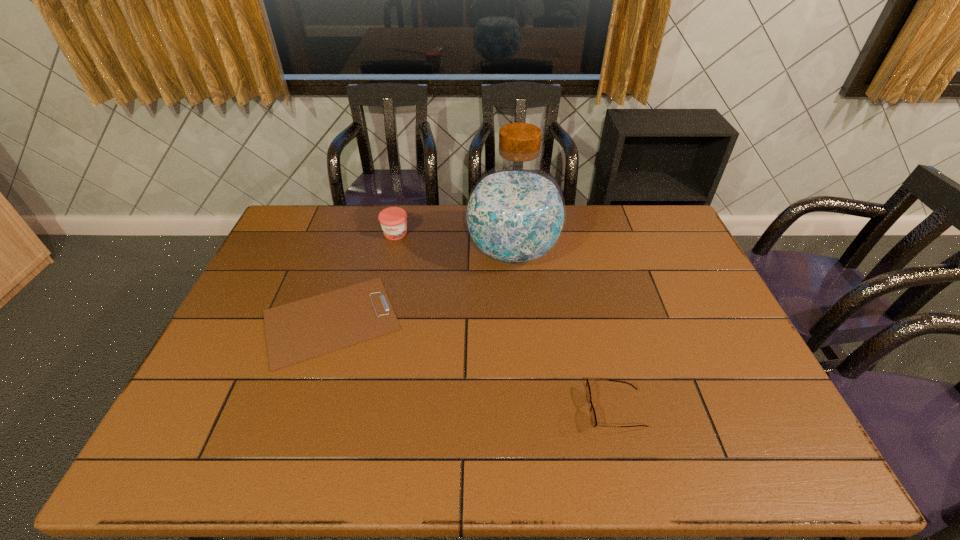
This screenshot has height=540, width=960. What are the coordinates of `water jug` in the screenshot? It's located at tap(515, 214).

The height and width of the screenshot is (540, 960). Identify the location of jam. (393, 220).

I want to click on the third tallest object, so click(588, 392).

Locate an element on the screen. This screenshot has width=960, height=540. spectacles is located at coordinates (588, 392).

Where is `clipboard`? The width and height of the screenshot is (960, 540). clipboard is located at coordinates (305, 329).

Identify the location of vacant space located on the front of the tallest object. The image size is (960, 540). (517, 305).

Where is `vacant space located 0.400m on the front label of the jam`? Image resolution: width=960 pixels, height=540 pixels. vacant space located 0.400m on the front label of the jam is located at coordinates (373, 329).

Locate an element on the screen. vacant region located 0.260m on the face of the nearest object is located at coordinates (482, 410).

Where is `vacant region located 0.350m on the face of the nearest object`? The height and width of the screenshot is (540, 960). vacant region located 0.350m on the face of the nearest object is located at coordinates (445, 410).

The height and width of the screenshot is (540, 960). I want to click on vacant space located 0.300m on the face of the nearest object, so [x=466, y=410].